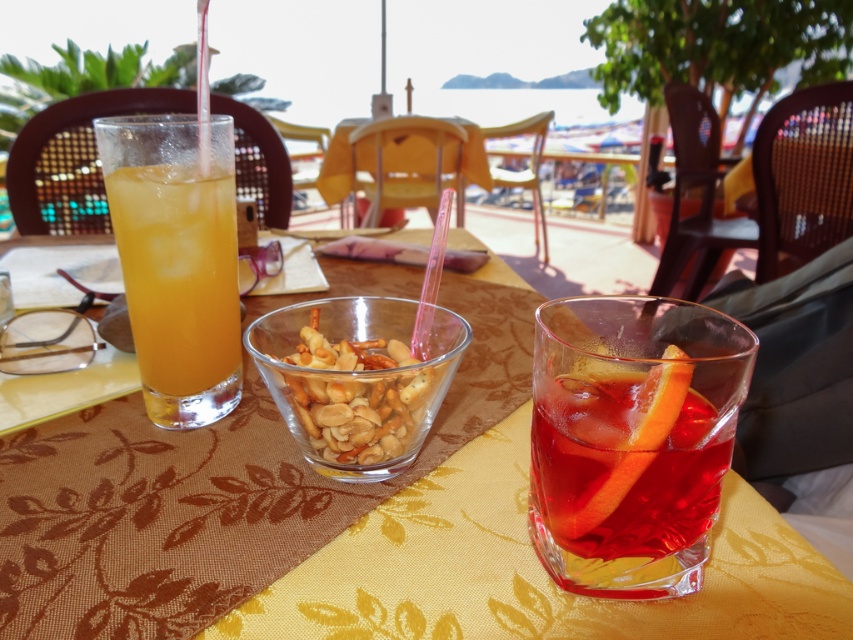
What do you see at coordinates (532, 568) in the screenshot? The height and width of the screenshot is (640, 853). I see `yellow fabric placemat at center` at bounding box center [532, 568].

Where is `yellow fabric placemat at center`? yellow fabric placemat at center is located at coordinates (532, 568).

Is yellow fabric placemat at center bigger than translucent glass bowl of mixed nuts at center?

Yes, yellow fabric placemat at center is bigger than translucent glass bowl of mixed nuts at center.

Can you confirm if yellow fabric placemat at center is taller than translucent glass bowl of mixed nuts at center?

Correct, yellow fabric placemat at center is much taller as translucent glass bowl of mixed nuts at center.

The height and width of the screenshot is (640, 853). What are the coordinates of `yellow fabric placemat at center` in the screenshot? It's located at (532, 568).

Does translucent glass drink at center have a lesser width compared to translucent glass bowl of mixed nuts at center?

Indeed, translucent glass drink at center has a lesser width compared to translucent glass bowl of mixed nuts at center.

Looking at this image, between translucent glass drink at center and translucent glass bowl of mixed nuts at center, which one has less height?

With less height is translucent glass drink at center.

The height and width of the screenshot is (640, 853). Find the location of `translucent glass drink at center`. translucent glass drink at center is located at coordinates pos(625,476).

The height and width of the screenshot is (640, 853). Find the location of `translucent glass drink at center`. translucent glass drink at center is located at coordinates (625, 476).